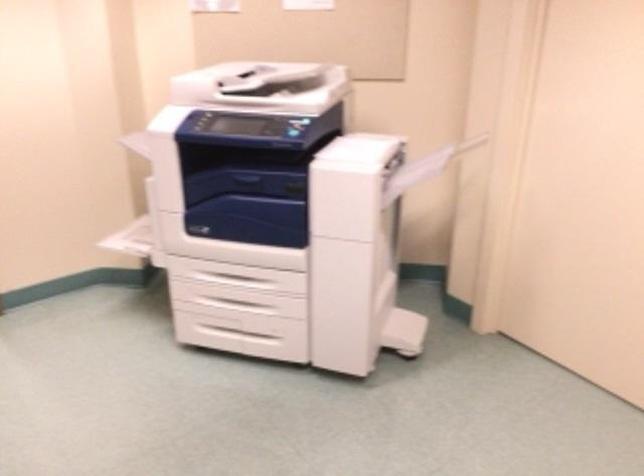
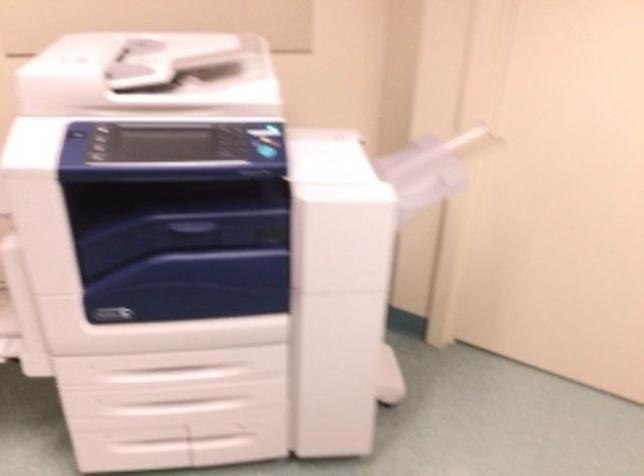
Where in the second image is the point corresponding to the point at 239,307 from the first image?

(180, 406)